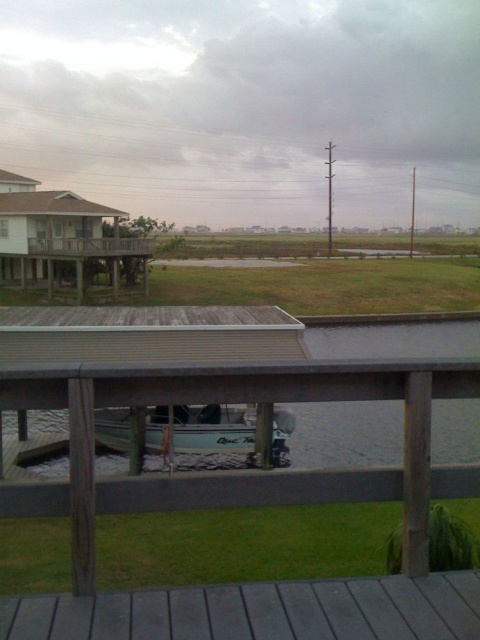
You are standing on the dark gray wood deck at lower center and want to walk to the light blue fiberglass boat at center. Since the deck is narrower than the boat, will you have enough space to walk around the boat without stepping off the deck?

The dark gray wood deck at lower center is narrower than the light blue fiberglass boat at center, so you might not have enough space to walk around the boat without stepping off the deck.

From the picture: You are standing on the dark gray wood deck at lower center and want to board the light blue fiberglass boat at center. Is the deck above the boat or below it?

The dark gray wood deck at lower center is positioned over the light blue fiberglass boat at center, so the deck is above the boat.